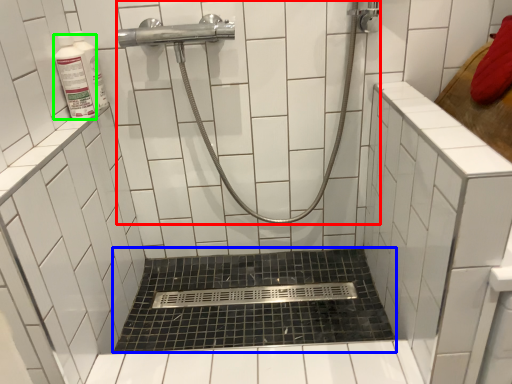
Question: Which is nearer to the shower (highlighted by a red box)? bath (highlighted by a blue box) or toiletry (highlighted by a green box).

Choices:
 (A) bath
 (B) toiletry

Answer: (B)